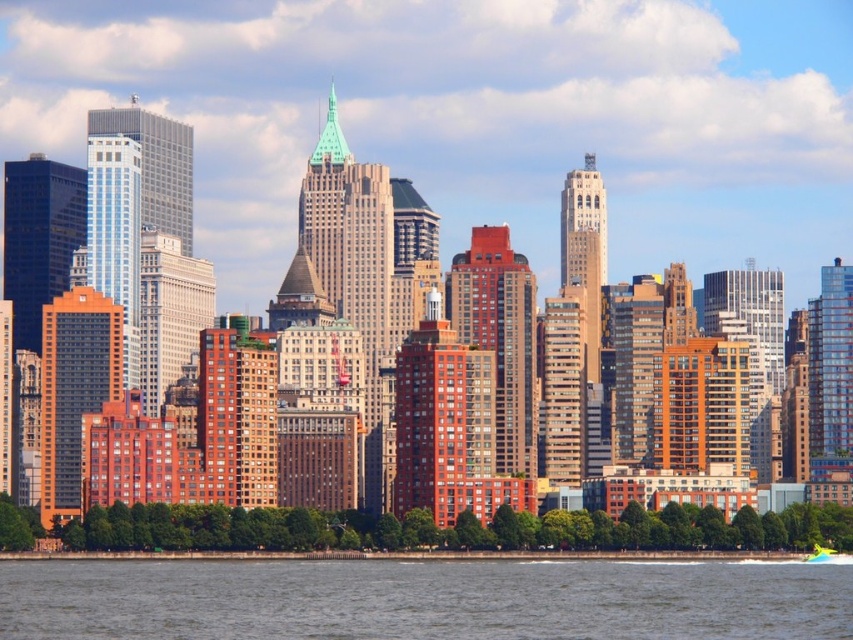
Question: Can you confirm if gray water at lower center is wider than green plastic boat at lower right?

Choices:
 (A) yes
 (B) no

Answer: (A)

Question: Which point is farther to the camera?

Choices:
 (A) gray water at lower center
 (B) green plastic boat at lower right

Answer: (B)

Question: Does gray water at lower center come behind green plastic boat at lower right?

Choices:
 (A) no
 (B) yes

Answer: (A)

Question: Where is gray water at lower center located in relation to green plastic boat at lower right in the image?

Choices:
 (A) below
 (B) above

Answer: (A)